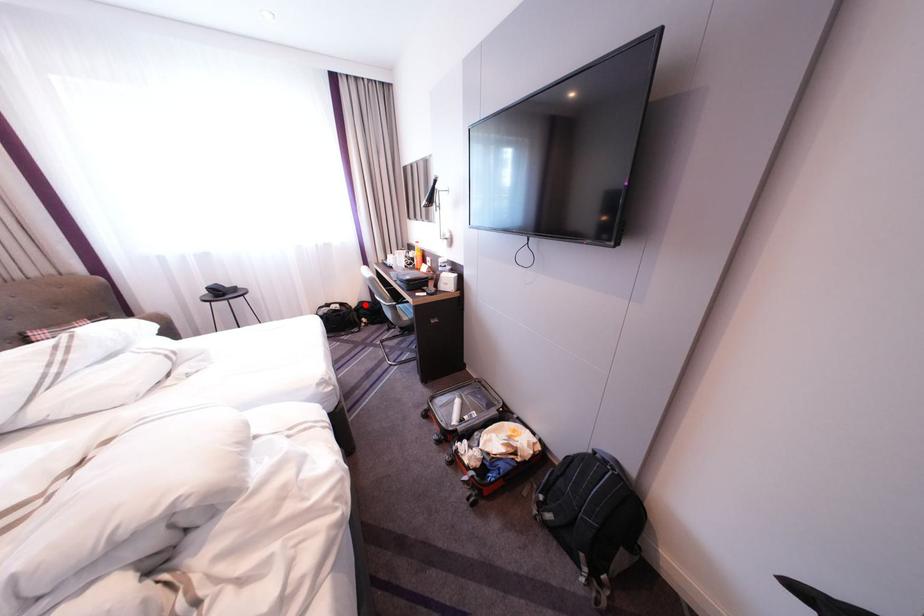
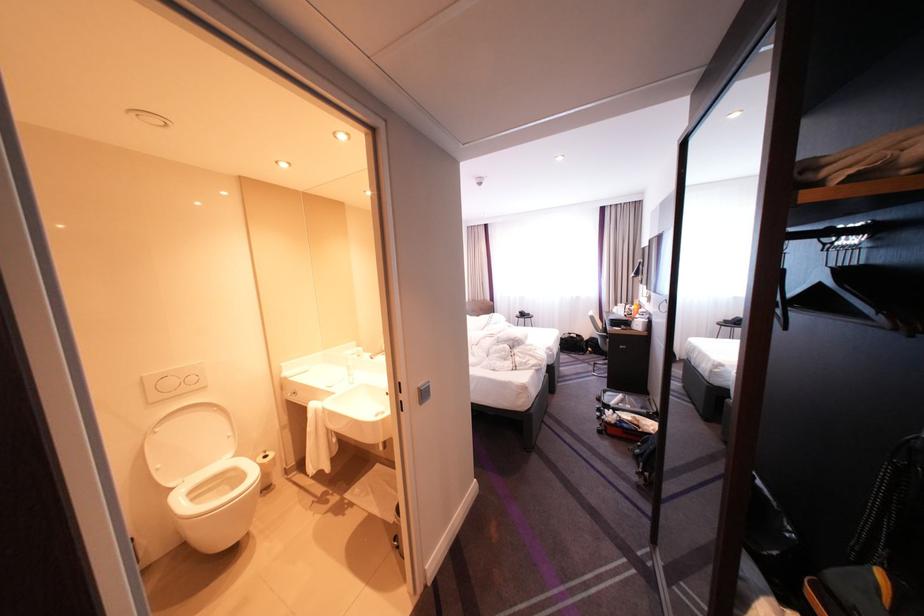
Question: I am providing you with two images of the same scene from different viewpoints. A red point is shown in image1. For the corresponding object point in image2, is it positioned nearer or farther from the camera?

Choices:
 (A) Nearer
 (B) Farther

Answer: (A)